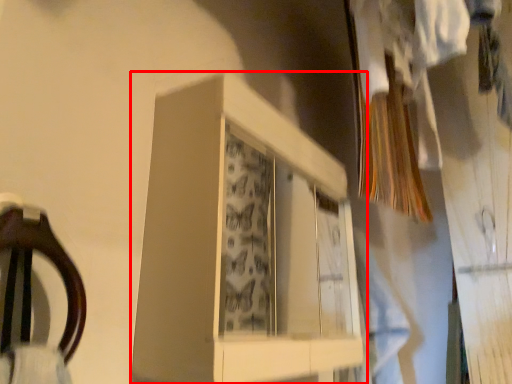
Question: Observing the image, what is the correct spatial positioning of cabinet (annotated by the red box) in reference to clothing?

Choices:
 (A) right
 (B) left

Answer: (B)